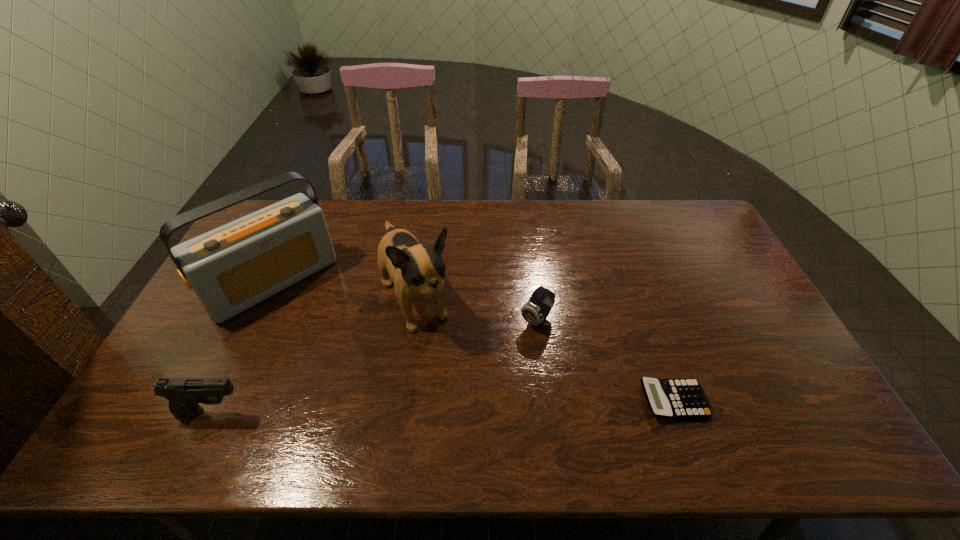
This screenshot has width=960, height=540. Identify the location of free space located on the face of the watch. (475, 386).

Find the location of a particular element. The image size is (960, 540). free space located 0.240m at the face of the third object from left to right is located at coordinates (468, 408).

At what (x,y) coordinates should I click in order to perform the action: click on free point located 0.070m at the face of the third object from left to right. Please return your answer as a coordinate pair (x, y). Image resolution: width=960 pixels, height=540 pixels. Looking at the image, I should click on (440, 358).

Where is `vacant space located at the face of the third object from left to right`? vacant space located at the face of the third object from left to right is located at coordinates (x=449, y=374).

Identify the location of free location located on the front-facing side of the radio receiver. The width and height of the screenshot is (960, 540). (346, 359).

At what (x,y) coordinates should I click in order to perform the action: click on free point located 0.060m on the front-facing side of the radio receiver. Please return your answer as a coordinate pair (x, y). Looking at the image, I should click on (312, 323).

Where is `vacant space situated on the front-facing side of the radio receiver`? vacant space situated on the front-facing side of the radio receiver is located at coordinates (346, 359).

The height and width of the screenshot is (540, 960). I want to click on pistol that is at the near edge, so click(x=184, y=394).

Locate an element on the screen. Image resolution: width=960 pixels, height=540 pixels. calculator present at the near edge is located at coordinates (675, 398).

I want to click on pistol present at the left edge, so click(x=184, y=394).